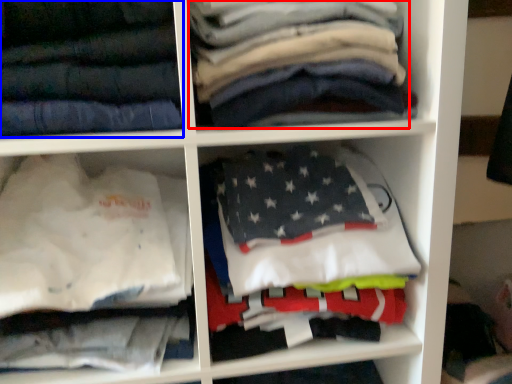
Question: Which of the following is the closest to the observer, clothing (highlighted by a red box) or trousers (highlighted by a blue box)?

Choices:
 (A) clothing
 (B) trousers

Answer: (B)